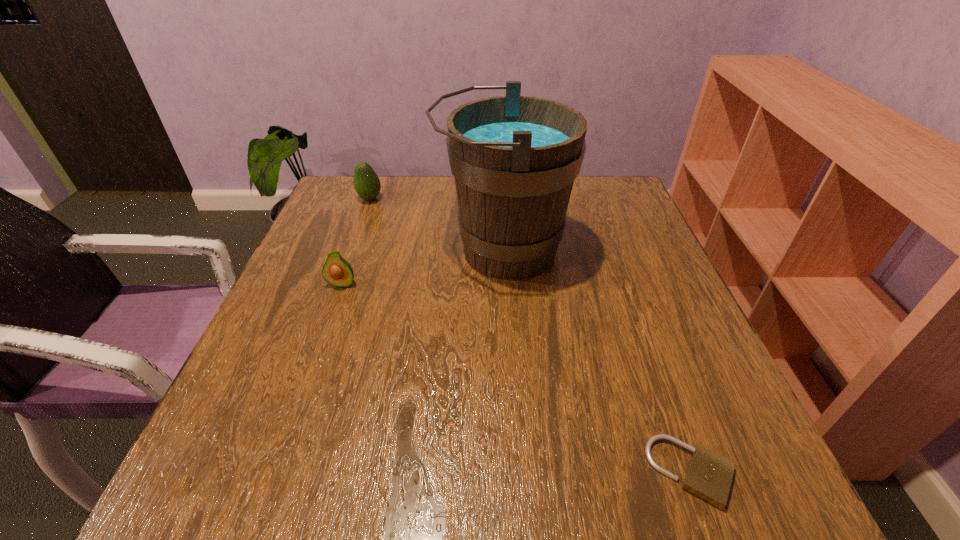
Find the location of a particular element. vacant space located 0.090m on the cut side of the nearer avocado is located at coordinates pos(328,322).

Locate an element on the screen. free space located 0.210m on the back of the padlock is located at coordinates (641, 333).

Identify the location of wine bucket that is positioned at the far edge. (514, 158).

Where is `avocado situated at the far edge`? avocado situated at the far edge is located at coordinates (367, 185).

Identify the location of object that is at the near edge. (709, 475).

Where is `object at the right edge`? object at the right edge is located at coordinates pos(709,475).

You are a GUI agent. You are given a task and a screenshot of the screen. Output one action in this format:
    pyautogui.click(x=<x>, y=<y>)
    Task: Click on the object at the far left corner
    This screenshot has height=540, width=960.
    Given the screenshot: What is the action you would take?
    pyautogui.click(x=367, y=185)

The width and height of the screenshot is (960, 540). In order to click on object positioned at the near right corner in this screenshot , I will do `click(709, 475)`.

Identify the location of vacant space at the far edge of the desktop. The image size is (960, 540). (401, 198).

Locate an element on the screen. free spot at the near edge of the desktop is located at coordinates (409, 460).